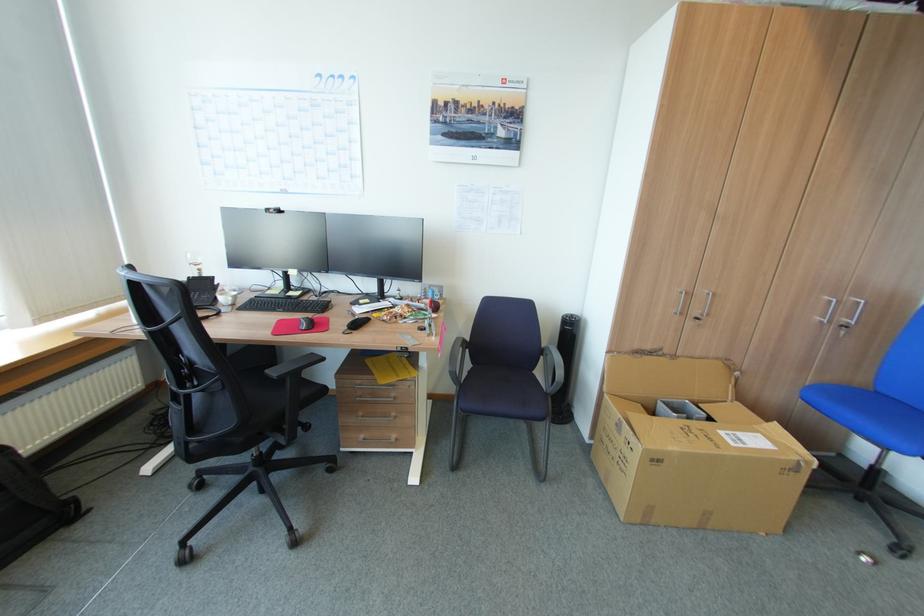
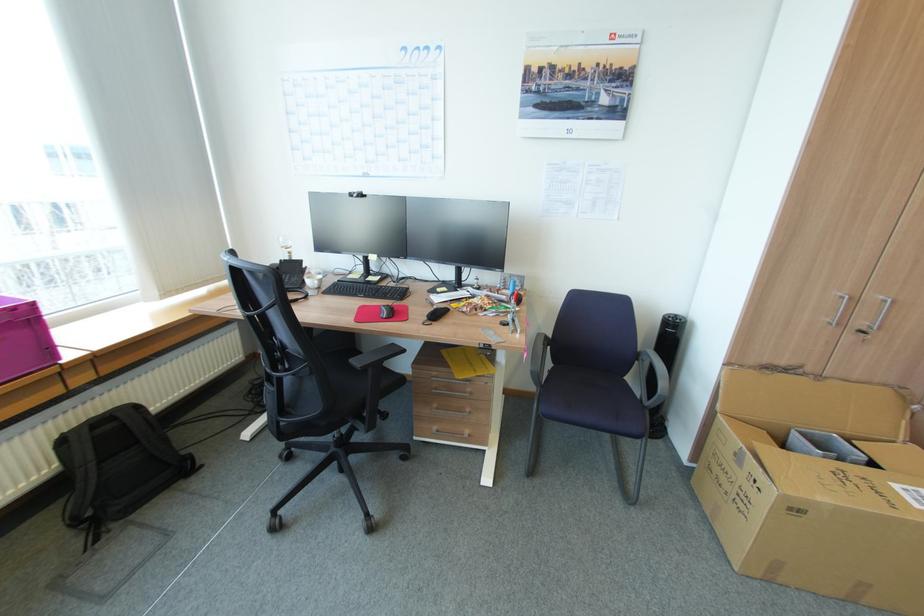
Find the pixel in the second image that matches point 394,397 in the first image.

(469, 392)